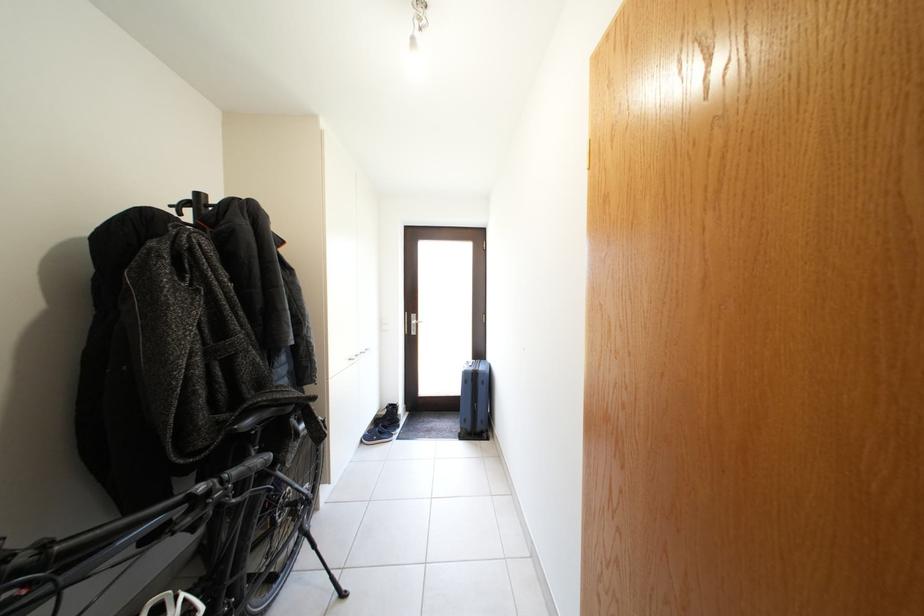
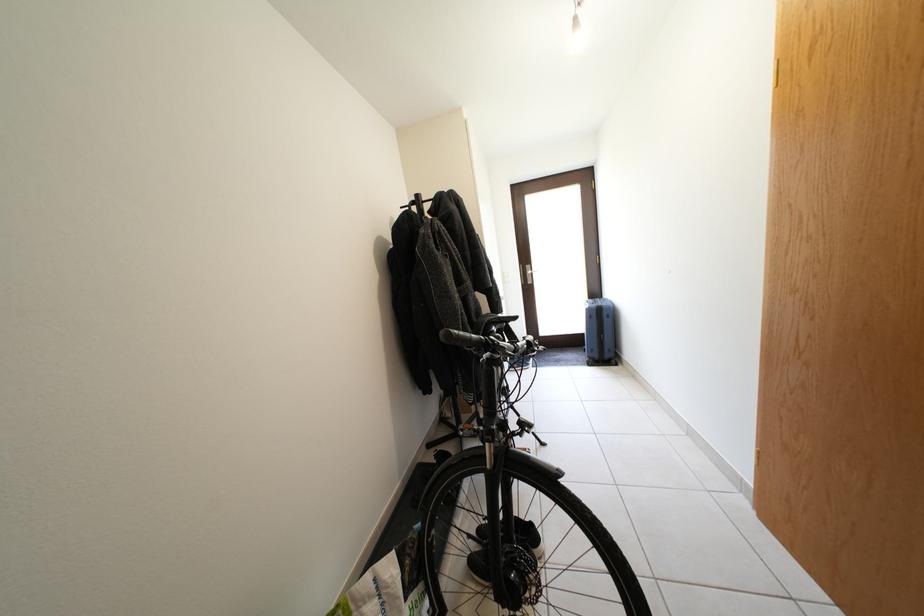
What movement of the cameraman would produce the second image?

The movement direction of the cameraman is left, backward.